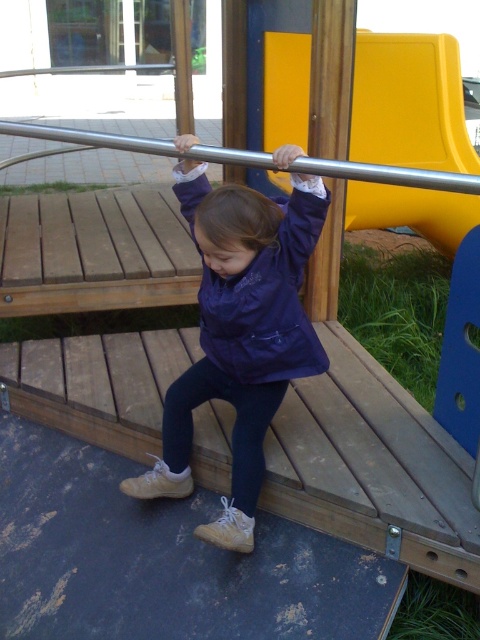
Does point (412, 74) lie behind point (344, 122)?

Yes, point (412, 74) is behind point (344, 122).

Which is behind, point (381, 160) or point (322, 284)?

Point (381, 160)

Where is `yellow plastic slide at upper center`? yellow plastic slide at upper center is located at coordinates (409, 104).

Can you confirm if purple fabric jacket at center is positioned below wooden pole at center?

Indeed, purple fabric jacket at center is positioned under wooden pole at center.

Which is behind, point (201, 401) or point (337, 243)?

The point (337, 243) is more distant.

This screenshot has width=480, height=640. Describe the element at coordinates (240, 333) in the screenshot. I see `purple fabric jacket at center` at that location.

The image size is (480, 640). In order to click on purple fabric jacket at center in this screenshot , I will do `click(240, 333)`.

Can you confirm if yellow plastic slide at upper center is shorter than navy blue fabric jacket at center?

No, yellow plastic slide at upper center is not shorter than navy blue fabric jacket at center.

Who is more forward, (463, 134) or (266, 280)?

Point (266, 280) is more forward.

Which is behind, point (433, 234) or point (311, 204)?

Point (433, 234)

I want to click on yellow plastic slide at upper center, so click(x=409, y=104).